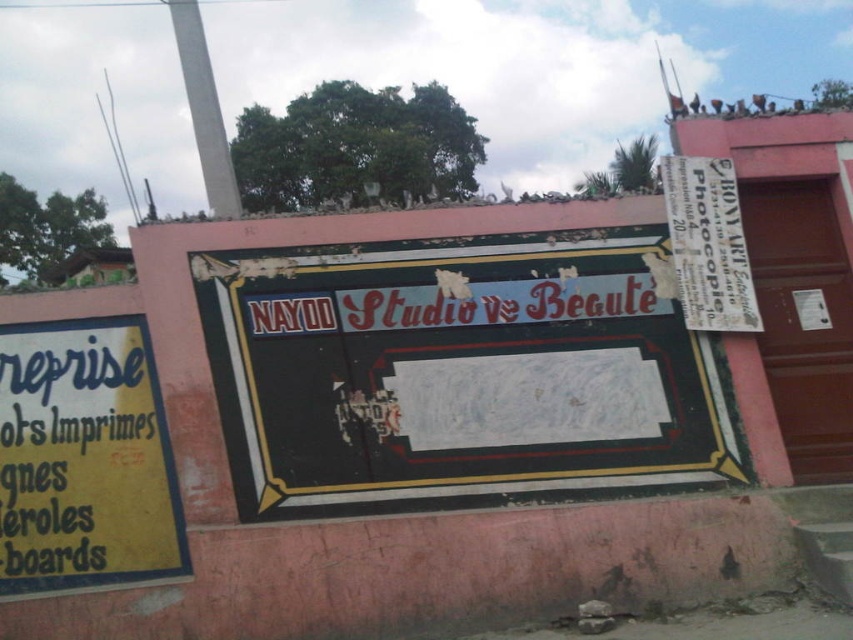
You are standing in front of the weathered wall with several signs. You want to locate the rusty metal signboard at center. Where exactly is it positioned on the wall?

The rusty metal signboard at center is positioned at point coordinates of 0.581 on the x axis and 0.537 on the y axis.